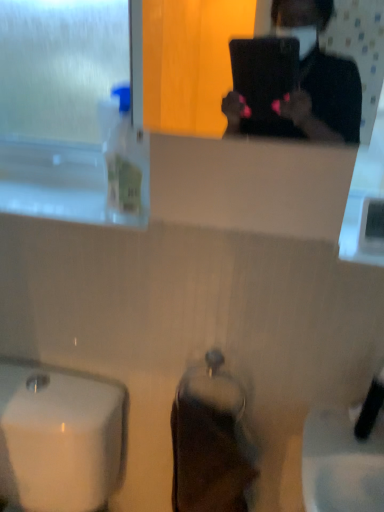
At what (x,y) coordinates should I click in order to perform the action: click on free space above clear plastic bottle at left (from a real-world perspective). Please return your answer as a coordinate pair (x, y). The height and width of the screenshot is (512, 384). Looking at the image, I should click on (45, 194).